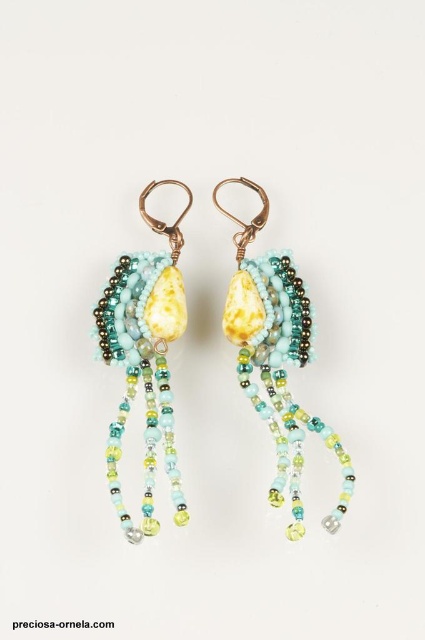
Who is taller, matte glass bead earring at left or matte yellow stone at center?

Standing taller between the two is matte yellow stone at center.

Can you confirm if matte glass bead earring at left is bigger than matte yellow stone at center?

Actually, matte glass bead earring at left might be smaller than matte yellow stone at center.

Who is more distant from viewer, (x=124, y=534) or (x=244, y=262)?

Positioned behind is point (x=244, y=262).

Image resolution: width=425 pixels, height=640 pixels. I want to click on matte glass bead earring at left, so click(144, 356).